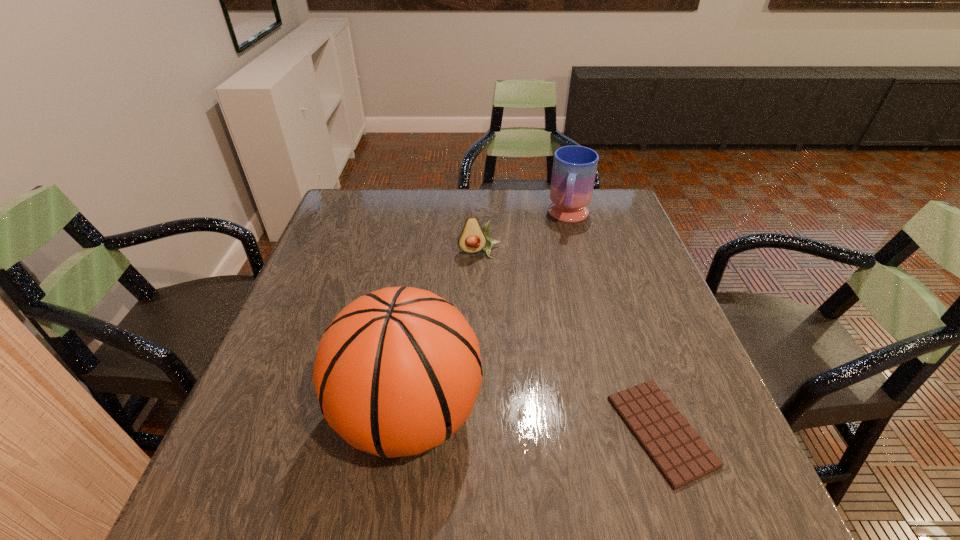
The width and height of the screenshot is (960, 540). In order to click on object that is at the near right corner in this screenshot , I will do `click(680, 454)`.

This screenshot has width=960, height=540. Identify the location of vacant region at the far edge. (390, 231).

In the image, there is a desktop. Where is `vacant space at the near edge`? vacant space at the near edge is located at coordinates (436, 449).

The width and height of the screenshot is (960, 540). In order to click on free point at the left edge in this screenshot , I will do `click(299, 310)`.

You are a GUI agent. You are given a task and a screenshot of the screen. Output one action in this format:
    pyautogui.click(x=<x>, y=<y>)
    Task: Click on the free space at the right edge of the desktop
    The height and width of the screenshot is (540, 960).
    Given the screenshot: What is the action you would take?
    pyautogui.click(x=670, y=330)

This screenshot has height=540, width=960. I want to click on vacant space at the far left corner of the desktop, so click(388, 195).

At what (x,y) coordinates should I click in order to perform the action: click on vacant space at the near left corner of the desktop. Please return your answer as a coordinate pair (x, y). The width and height of the screenshot is (960, 540). Looking at the image, I should click on (235, 437).

You are a GUI agent. You are given a task and a screenshot of the screen. Output one action in this format:
    pyautogui.click(x=<x>, y=<y>)
    Task: Click on the free space between the second tallest object and the chocolate bar
    This screenshot has height=540, width=960.
    Given the screenshot: What is the action you would take?
    pyautogui.click(x=615, y=324)

Identify the location of free spot between the tallest object and the mug. This screenshot has width=960, height=540. (490, 316).

Identify the location of free spot between the chocolate bar and the avocado. (570, 342).